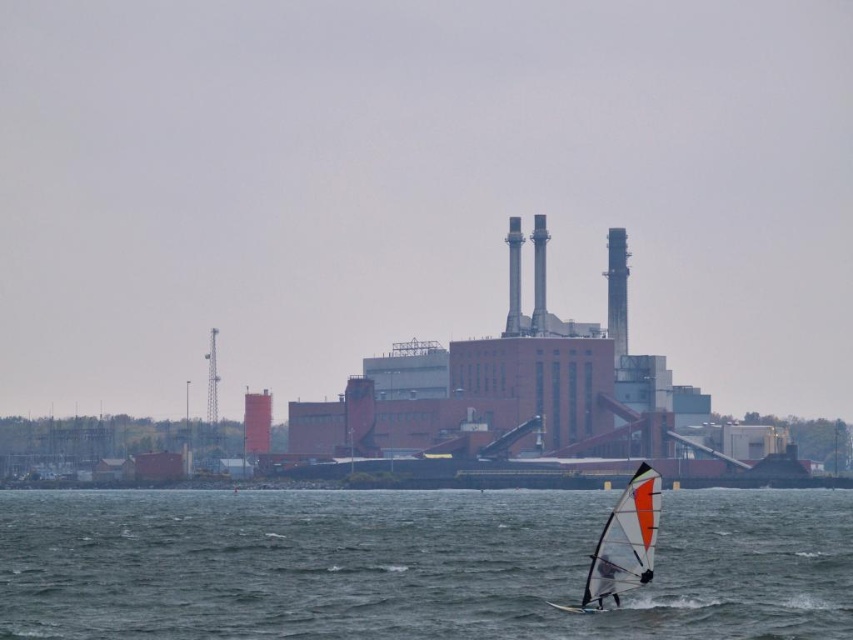
Question: Based on their relative distances, which object is nearer to the white matte sail at center?

Choices:
 (A) white and orange sail at lower center
 (B) blue water at lower center

Answer: (A)

Question: Where is blue water at lower center located in relation to white and orange sail at lower center in the image?

Choices:
 (A) right
 (B) left

Answer: (B)

Question: Among these objects, which one is nearest to the camera?

Choices:
 (A) white matte sail at center
 (B) blue water at lower center

Answer: (B)

Question: Which point is farther to the camera?

Choices:
 (A) white matte sail at center
 (B) blue water at lower center

Answer: (A)

Question: Does white and orange sail at lower center appear over white matte sail at center?

Choices:
 (A) yes
 (B) no

Answer: (A)

Question: Does white and orange sail at lower center lie in front of white matte sail at center?

Choices:
 (A) yes
 (B) no

Answer: (A)